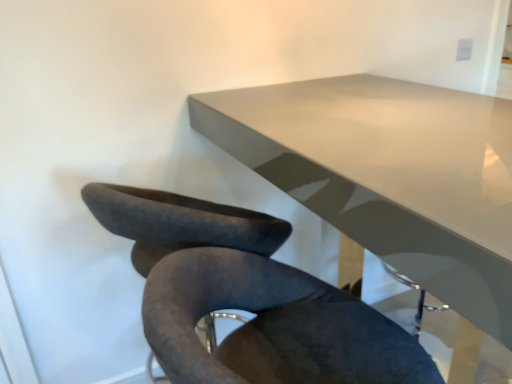
Where is `white glossy table at upper center`? The height and width of the screenshot is (384, 512). white glossy table at upper center is located at coordinates (389, 175).

The image size is (512, 384). Describe the element at coordinates (389, 175) in the screenshot. I see `white glossy table at upper center` at that location.

The height and width of the screenshot is (384, 512). What do you see at coordinates (247, 298) in the screenshot? I see `velvet dark gray chair at lower center` at bounding box center [247, 298].

Where is `velvet dark gray chair at lower center`? velvet dark gray chair at lower center is located at coordinates (247, 298).

Image resolution: width=512 pixels, height=384 pixels. In order to click on white glossy table at upper center in this screenshot , I will do point(389,175).

Between white glossy table at upper center and velvet dark gray chair at lower center, which one appears on the right side from the viewer's perspective?

white glossy table at upper center.

Which object is further away from the camera, white glossy table at upper center or velvet dark gray chair at lower center?

Positioned behind is white glossy table at upper center.

Which is in front, point (447, 299) or point (226, 235)?

The point (447, 299) is more forward.

From the image's perspective, is white glossy table at upper center located above or below velvet dark gray chair at lower center?

white glossy table at upper center is above velvet dark gray chair at lower center.

From a real-world perspective, which is physically below, white glossy table at upper center or velvet dark gray chair at lower center?

white glossy table at upper center, from a real-world perspective.

Considering the sizes of objects white glossy table at upper center and velvet dark gray chair at lower center in the image provided, who is wider, white glossy table at upper center or velvet dark gray chair at lower center?

With larger width is white glossy table at upper center.

Can you confirm if white glossy table at upper center is taller than velvet dark gray chair at lower center?

Yes.

Is white glossy table at upper center bigger than velvet dark gray chair at lower center?

Yes.

Is white glossy table at upper center not within velvet dark gray chair at lower center?

Yes, white glossy table at upper center is outside of velvet dark gray chair at lower center.

Is white glossy table at upper center not close to velvet dark gray chair at lower center?

Actually, white glossy table at upper center and velvet dark gray chair at lower center are a little close together.

Is white glossy table at upper center positioned with its back to velvet dark gray chair at lower center?

No, white glossy table at upper center's orientation is not away from velvet dark gray chair at lower center.

What's the angular difference between white glossy table at upper center and velvet dark gray chair at lower center's facing directions?

The facing directions of white glossy table at upper center and velvet dark gray chair at lower center are 90 degrees apart.

Where is `table behind the velvet dark gray chair at lower center`? The width and height of the screenshot is (512, 384). table behind the velvet dark gray chair at lower center is located at coordinates (389, 175).

Does velvet dark gray chair at lower center appear on the right side of white glossy table at upper center?

Incorrect, velvet dark gray chair at lower center is not on the right side of white glossy table at upper center.

Considering the relative positions of velvet dark gray chair at lower center and white glossy table at upper center in the image provided, is velvet dark gray chair at lower center behind white glossy table at upper center?

No, velvet dark gray chair at lower center is in front of white glossy table at upper center.

Which is closer, (233, 223) or (433, 232)?

Point (433, 232)

From the image's perspective, which is below, velvet dark gray chair at lower center or white glossy table at upper center?

velvet dark gray chair at lower center is shown below in the image.

From a real-world perspective, is velvet dark gray chair at lower center positioned above or below white glossy table at upper center?

velvet dark gray chair at lower center is situated higher than white glossy table at upper center in the real world.

Is velvet dark gray chair at lower center wider or thinner than white glossy table at upper center?

Clearly, velvet dark gray chair at lower center has less width compared to white glossy table at upper center.

Looking at this image, considering the relative sizes of velvet dark gray chair at lower center and white glossy table at upper center in the image provided, is velvet dark gray chair at lower center shorter than white glossy table at upper center?

Yes.

Who is smaller, velvet dark gray chair at lower center or white glossy table at upper center?

Smaller between the two is velvet dark gray chair at lower center.

Would you say white glossy table at upper center is part of velvet dark gray chair at lower center's contents?

No, velvet dark gray chair at lower center does not contain white glossy table at upper center.

Is velvet dark gray chair at lower center far away from white glossy table at upper center?

That's not correct — velvet dark gray chair at lower center is a little close to white glossy table at upper center.

Is velvet dark gray chair at lower center facing away from white glossy table at upper center?

No, velvet dark gray chair at lower center is not facing the opposite direction of white glossy table at upper center.

How many degrees apart are the facing directions of velvet dark gray chair at lower center and white glossy table at upper center?

The facing directions of velvet dark gray chair at lower center and white glossy table at upper center are 90 degrees apart.

You are a GUI agent. You are given a task and a screenshot of the screen. Output one action in this format:
    pyautogui.click(x=<x>, y=<y>)
    Task: Click on the chair that is on the left side of white glossy table at upper center
    This screenshot has width=512, height=384.
    Given the screenshot: What is the action you would take?
    pyautogui.click(x=247, y=298)

There is a white glossy table at upper center. Identify the location of chair above it (from a real-world perspective). This screenshot has width=512, height=384. (247, 298).

This screenshot has width=512, height=384. What are the coordinates of `table on the right of the velvet dark gray chair at lower center` in the screenshot? It's located at (389, 175).